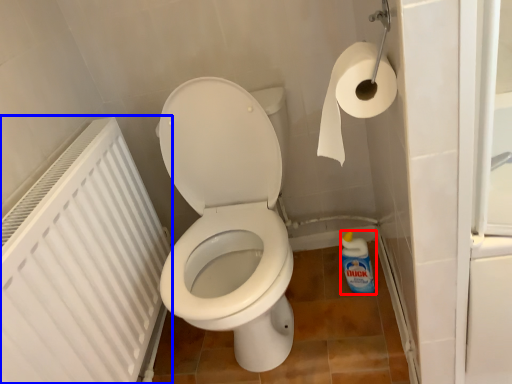
Question: Which object is further to the camera taking this photo, cleaning product (highlighted by a red box) or radiator (highlighted by a blue box)?

Choices:
 (A) cleaning product
 (B) radiator

Answer: (A)